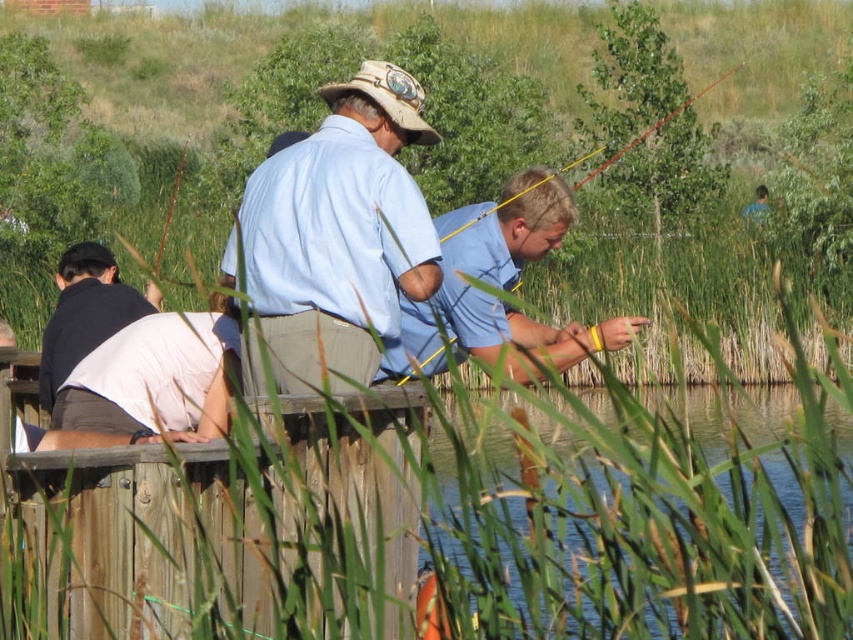
Does wooden at center have a lesser width compared to clear water at lower right?

Incorrect, wooden at center's width is not less than clear water at lower right's.

Find the location of `wooden at center`. wooden at center is located at coordinates (451, 524).

The image size is (853, 640). What do you see at coordinates (451, 524) in the screenshot? I see `wooden at center` at bounding box center [451, 524].

Where is `wooden at center`? The height and width of the screenshot is (640, 853). wooden at center is located at coordinates (451, 524).

Does point (454, 298) come behind point (91, 308)?

No, it is in front of (91, 308).

Between point (508, 211) and point (45, 330), which one is positioned behind?

The point (45, 330) is more distant.

Which is behind, point (535, 332) or point (45, 369)?

The point (45, 369) is behind.

Image resolution: width=853 pixels, height=640 pixels. In order to click on blue shirt at center in this screenshot , I will do `click(497, 285)`.

Does light blue cotton shirt at center appear under blue shirt at center?

Result: Actually, light blue cotton shirt at center is above blue shirt at center.

Is point (334, 186) positioned after point (558, 346)?

No.

At what (x,y) coordinates should I click in order to perform the action: click on light blue cotton shirt at center. Please return your answer as a coordinate pair (x, y). The image size is (853, 640). Looking at the image, I should click on (340, 232).